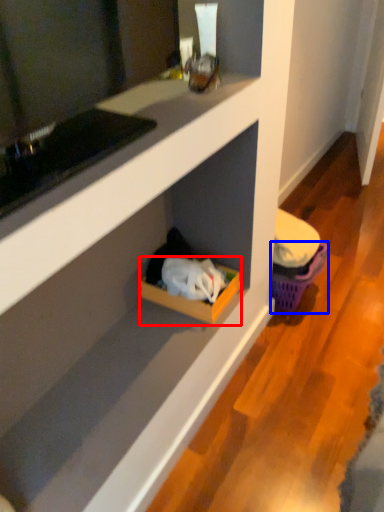
Question: Which of the following is the closest to the observer, storage box (highlighted by a red box) or basket (highlighted by a blue box)?

Choices:
 (A) storage box
 (B) basket

Answer: (A)